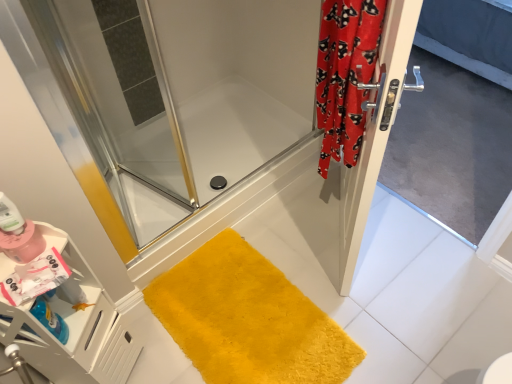
Question: Considering the relative positions of yellow plush bath mat at lower center and red velvet curtain at right in the image provided, is yellow plush bath mat at lower center behind red velvet curtain at right?

Choices:
 (A) no
 (B) yes

Answer: (B)

Question: Can you confirm if yellow plush bath mat at lower center is taller than red velvet curtain at right?

Choices:
 (A) yes
 (B) no

Answer: (B)

Question: Considering the relative positions of yellow plush bath mat at lower center and red velvet curtain at right in the image provided, is yellow plush bath mat at lower center to the left of red velvet curtain at right from the viewer's perspective?

Choices:
 (A) no
 (B) yes

Answer: (B)

Question: Can you confirm if yellow plush bath mat at lower center is shorter than red velvet curtain at right?

Choices:
 (A) yes
 (B) no

Answer: (A)

Question: From a real-world perspective, is yellow plush bath mat at lower center beneath red velvet curtain at right?

Choices:
 (A) yes
 (B) no

Answer: (A)

Question: In the image, is matte pink bottle at lower left positioned in front of or behind silver metallic screen door at right?

Choices:
 (A) behind
 (B) front

Answer: (B)

Question: Looking at their shapes, would you say matte pink bottle at lower left is wider or thinner than silver metallic screen door at right?

Choices:
 (A) wide
 (B) thin

Answer: (B)

Question: From a real-world perspective, is matte pink bottle at lower left above or below silver metallic screen door at right?

Choices:
 (A) above
 (B) below

Answer: (A)

Question: In terms of height, does matte pink bottle at lower left look taller or shorter compared to silver metallic screen door at right?

Choices:
 (A) tall
 (B) short

Answer: (B)

Question: Choose the correct answer: Is silver metallic screen door at right inside clear glass shower door at center or outside it?

Choices:
 (A) inside
 (B) outside

Answer: (B)

Question: Considering their positions, is silver metallic screen door at right located in front of or behind clear glass shower door at center?

Choices:
 (A) behind
 (B) front

Answer: (B)

Question: In terms of width, does silver metallic screen door at right look wider or thinner when compared to clear glass shower door at center?

Choices:
 (A) wide
 (B) thin

Answer: (B)

Question: Visually, is silver metallic screen door at right positioned to the left or to the right of clear glass shower door at center?

Choices:
 (A) left
 (B) right

Answer: (B)

Question: From the image's perspective, is silver metallic screen door at right positioned above or below satin silver door at right?

Choices:
 (A) below
 (B) above

Answer: (A)

Question: Relative to satin silver door at right, is silver metallic screen door at right in front or behind?

Choices:
 (A) front
 (B) behind

Answer: (B)